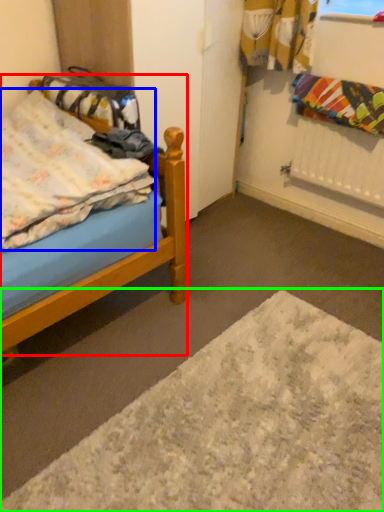
Question: Which is farther away from bed (highlighted by a red box)? blanket (highlighted by a blue box) or plain (highlighted by a green box)?

Choices:
 (A) blanket
 (B) plain

Answer: (B)